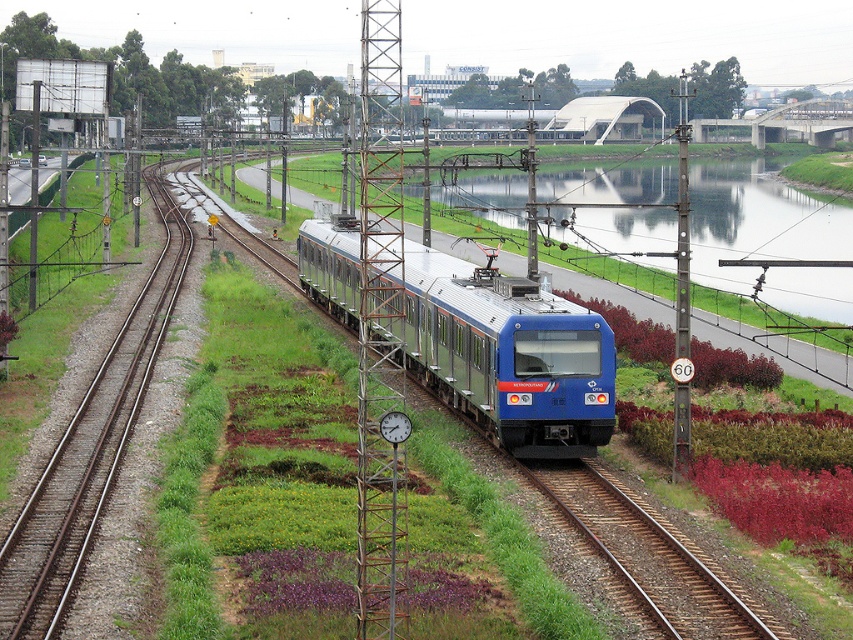
Question: Which point is closer to the camera?

Choices:
 (A) (804, 228)
 (B) (462, 284)

Answer: (B)

Question: Can you confirm if reflective glass waterway at center is positioned to the right of blue metallic train at center?

Choices:
 (A) yes
 (B) no

Answer: (A)

Question: Which point appears farthest from the camera in this image?

Choices:
 (A) (556, 371)
 (B) (663, 150)

Answer: (B)

Question: Does reflective glass waterway at center appear on the right side of blue metallic train at center?

Choices:
 (A) no
 (B) yes

Answer: (B)

Question: Does reflective glass waterway at center have a larger size compared to blue metallic train at center?

Choices:
 (A) yes
 (B) no

Answer: (A)